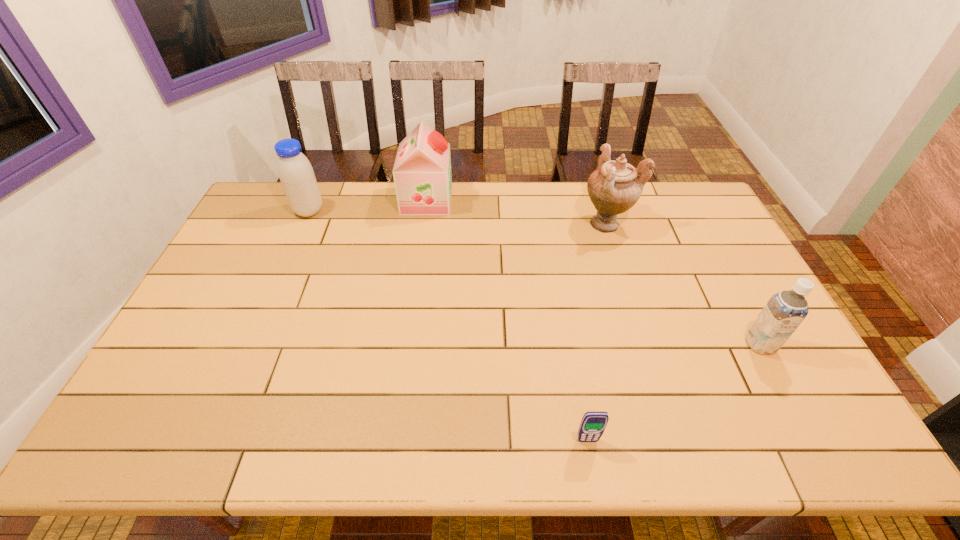
Image resolution: width=960 pixels, height=540 pixels. In order to click on the second soya milk from left to right in this screenshot , I will do `click(422, 176)`.

In order to click on the second object from right to left in this screenshot , I will do `click(614, 187)`.

The height and width of the screenshot is (540, 960). Find the location of `the leftmost soya milk`. the leftmost soya milk is located at coordinates (296, 174).

Locate an element on the screen. the rightmost soya milk is located at coordinates (784, 312).

This screenshot has height=540, width=960. Find the location of `the fourth farthest object`. the fourth farthest object is located at coordinates (784, 312).

Where is `cellular telephone`? cellular telephone is located at coordinates (593, 424).

This screenshot has width=960, height=540. I want to click on the shortest object, so click(593, 424).

Image resolution: width=960 pixels, height=540 pixels. In order to click on free location located with the cap open on the second object from left to right in this screenshot , I will do `click(465, 200)`.

Locate an element on the screen. vacant region located on the right of the urn is located at coordinates (715, 224).

Where is `vacant region located on the back of the leftmost soya milk`? This screenshot has height=540, width=960. vacant region located on the back of the leftmost soya milk is located at coordinates (319, 189).